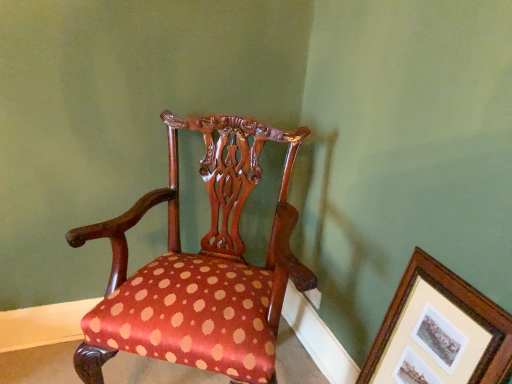
Where is `wooden picture frame at upper right`? wooden picture frame at upper right is located at coordinates (439, 332).

This screenshot has height=384, width=512. What do you see at coordinates (439, 332) in the screenshot? I see `wooden picture frame at upper right` at bounding box center [439, 332].

What do you see at coordinates (200, 268) in the screenshot?
I see `polished wood chair at center` at bounding box center [200, 268].

This screenshot has width=512, height=384. In order to click on polished wood chair at center in this screenshot , I will do `click(200, 268)`.

What is the approximate height of polished wood chair at center?

polished wood chair at center is 38.20 inches in height.

Identify the location of wooden picture frame at upper right. Image resolution: width=512 pixels, height=384 pixels. (439, 332).

Is polished wood chair at center to the left or to the right of wooden picture frame at upper right in the image?

polished wood chair at center is positioned on wooden picture frame at upper right's left side.

Does polished wood chair at center lie in front of wooden picture frame at upper right?

No, it is behind wooden picture frame at upper right.

Is point (112, 287) behind point (486, 348)?

Yes.

From the image's perspective, is polished wood chair at center located above or below wooden picture frame at upper right?

Based on their image positions, polished wood chair at center is located above wooden picture frame at upper right.

In the scene shown: From a real-world perspective, which is physically above, polished wood chair at center or wooden picture frame at upper right?

polished wood chair at center is physically above.

Can you confirm if polished wood chair at center is wider than wooden picture frame at upper right?

Yes.

Considering the sizes of objects polished wood chair at center and wooden picture frame at upper right in the image provided, who is shorter, polished wood chair at center or wooden picture frame at upper right?

wooden picture frame at upper right is shorter.

In the scene shown: Can you confirm if polished wood chair at center is bigger than wooden picture frame at upper right?

Yes.

Is polished wood chair at center located outside wooden picture frame at upper right?

Yes, polished wood chair at center is outside of wooden picture frame at upper right.

Is polished wood chair at center not near wooden picture frame at upper right?

Actually, polished wood chair at center and wooden picture frame at upper right are a little close together.

Does polished wood chair at center turn towards wooden picture frame at upper right?

No, polished wood chair at center is not aimed at wooden picture frame at upper right.

Can you tell me how much polished wood chair at center and wooden picture frame at upper right differ in facing direction?

There is a 57.6-degree angle between the facing directions of polished wood chair at center and wooden picture frame at upper right.

How distant is polished wood chair at center from wooden picture frame at upper right?

polished wood chair at center is 20.43 inches away from wooden picture frame at upper right.

Identify the location of chair behind the wooden picture frame at upper right. The width and height of the screenshot is (512, 384). (200, 268).

Based on the photo, is wooden picture frame at upper right at the left side of polished wood chair at center?

Incorrect, wooden picture frame at upper right is not on the left side of polished wood chair at center.

Does wooden picture frame at upper right come in front of polished wood chair at center?

Yes, wooden picture frame at upper right is closer to the camera.

Is point (450, 345) positioned in front of point (270, 276)?

Yes, it is in front of point (270, 276).

From the picture: From the image's perspective, would you say wooden picture frame at upper right is positioned over polished wood chair at center?

No, from the image's perspective, wooden picture frame at upper right is not on top of polished wood chair at center.

From a real-world perspective, is wooden picture frame at upper right physically located above or below polished wood chair at center?

From a real-world perspective, wooden picture frame at upper right is physically below polished wood chair at center.

Which object is wider, wooden picture frame at upper right or polished wood chair at center?

polished wood chair at center is wider.

Considering the relative sizes of wooden picture frame at upper right and polished wood chair at center in the image provided, is wooden picture frame at upper right shorter than polished wood chair at center?

Correct, wooden picture frame at upper right is not as tall as polished wood chair at center.

Which of these two, wooden picture frame at upper right or polished wood chair at center, is smaller?

With smaller size is wooden picture frame at upper right.

Is wooden picture frame at upper right situated inside polished wood chair at center or outside?

wooden picture frame at upper right is outside polished wood chair at center.

Would you consider wooden picture frame at upper right to be distant from polished wood chair at center?

No, there isn't a large distance between wooden picture frame at upper right and polished wood chair at center.

Looking at this image, is wooden picture frame at upper right oriented away from polished wood chair at center?

wooden picture frame at upper right does not have its back to polished wood chair at center.

How much distance is there between wooden picture frame at upper right and polished wood chair at center?

The distance of wooden picture frame at upper right from polished wood chair at center is 51.90 centimeters.

The image size is (512, 384). In order to click on picture frame on the right of the polished wood chair at center in this screenshot , I will do `click(439, 332)`.

Locate an element on the screen. picture frame that is on the right side of polished wood chair at center is located at coordinates (439, 332).

Where is `chair that is on the left side of wooden picture frame at upper right`? Image resolution: width=512 pixels, height=384 pixels. chair that is on the left side of wooden picture frame at upper right is located at coordinates (200, 268).